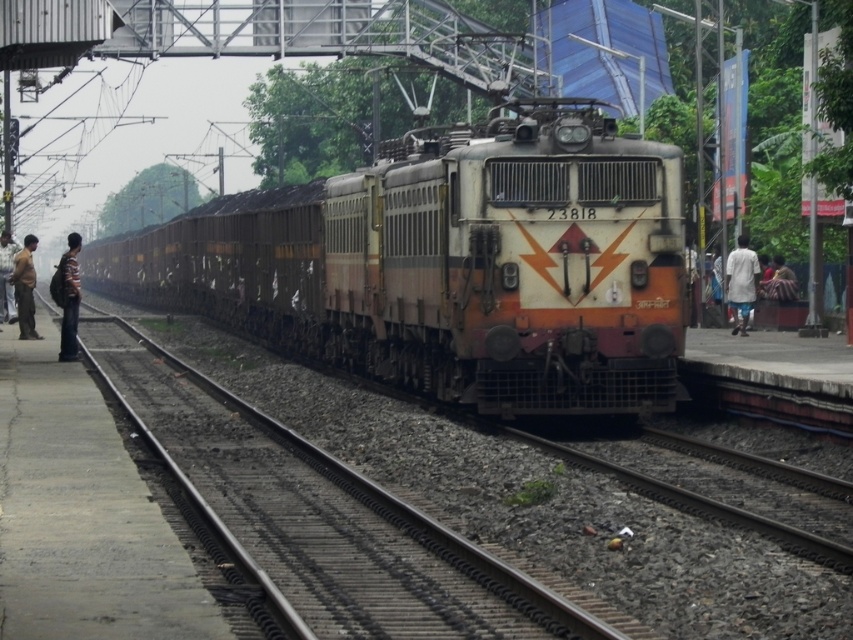
Question: Which object is closer to the camera taking this photo?

Choices:
 (A) gravel at center
 (B) brown cotton shirt at left
 (C) white cotton shirt at right
 (D) light brown fabric shirt at left

Answer: (A)

Question: Is brown cotton shirt at left to the right of light brown fabric shirt at left from the viewer's perspective?

Choices:
 (A) no
 (B) yes

Answer: (B)

Question: Which point is farther from the camera taking this photo?

Choices:
 (A) (399, 568)
 (B) (68, 253)
 (C) (7, 300)
 (D) (134, 280)

Answer: (D)

Question: Is orange metallic train at center positioned behind gravel at center?

Choices:
 (A) yes
 (B) no

Answer: (A)

Question: Which of the following is the farthest from the observer?

Choices:
 (A) orange metallic train at center
 (B) striped shirt at left
 (C) brown gravel train track at center

Answer: (B)

Question: Is orange metallic train at center to the right of striped shirt at left from the viewer's perspective?

Choices:
 (A) yes
 (B) no

Answer: (B)